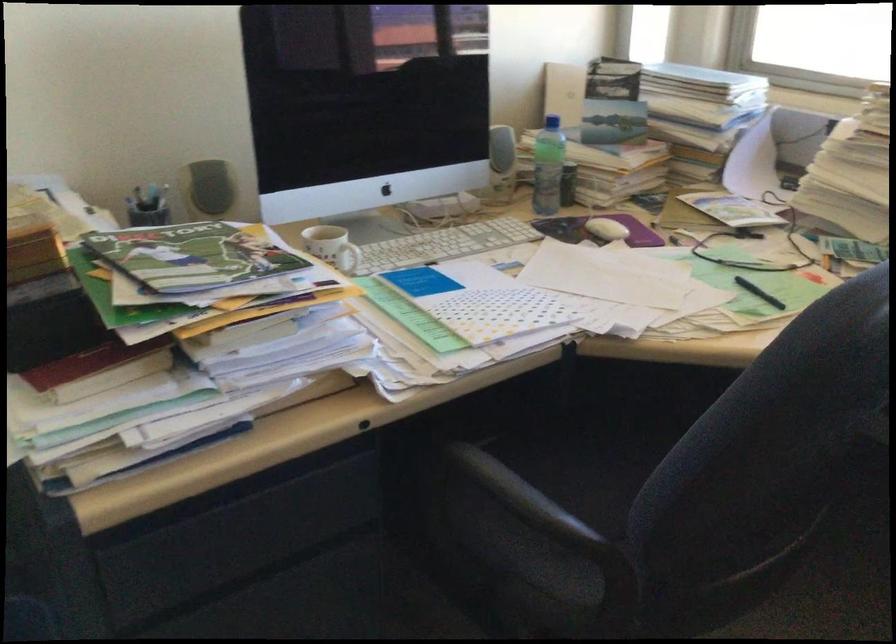
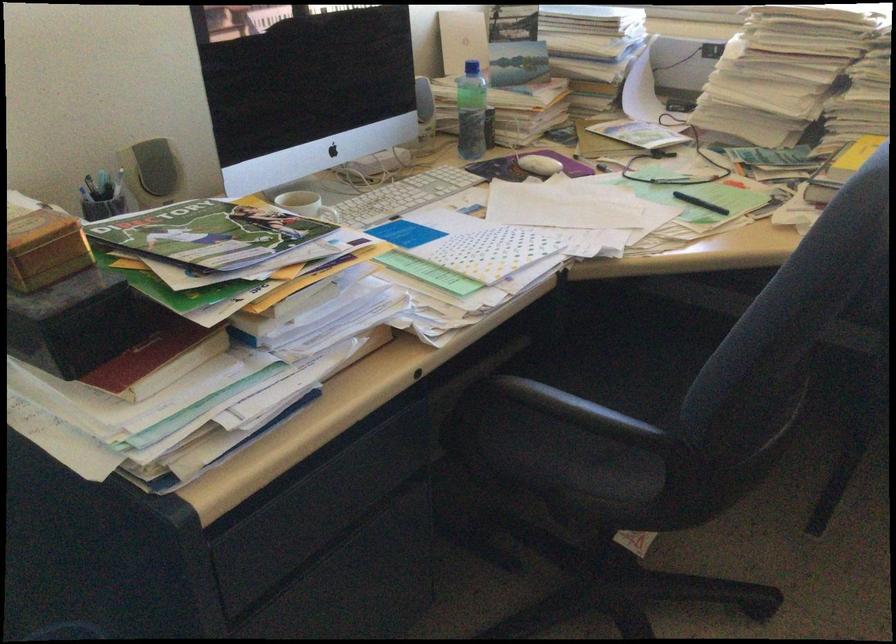
Question: I am providing you with two images of the same scene from different viewpoints. Please identify which objects are invisible in image2.

Choices:
 (A) plastic water bottle
 (B) white computer mouse
 (C) white mug handle
 (D) pot side handle

Answer: (C)